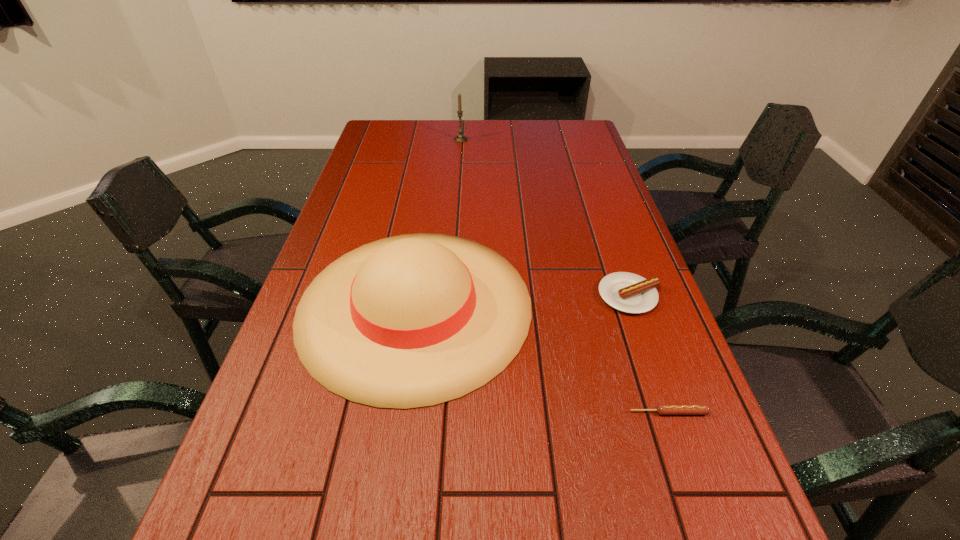
Where is `free space between the shortest object and the sombrero`? This screenshot has width=960, height=540. free space between the shortest object and the sombrero is located at coordinates (541, 359).

Locate an element on the screen. This screenshot has width=960, height=540. free space between the farther sausage and the candle is located at coordinates (545, 218).

Find the location of `empty location between the sombrero and the shortest object`. empty location between the sombrero and the shortest object is located at coordinates (541, 359).

The width and height of the screenshot is (960, 540). What are the coordinates of `empty space between the candle and the taller sausage` in the screenshot? It's located at (545, 218).

Where is `empty space that is in between the farthest object and the sombrero`? The image size is (960, 540). empty space that is in between the farthest object and the sombrero is located at coordinates (438, 222).

Identify which object is the third nearest to the shortest object. Please provide its 2D coordinates. Your answer should be formatted as a tuple, i.e. [(x, y)], where the tuple contains the x and y coordinates of a point satisfying the conditions above.

[(460, 138)]

Locate an element on the screen. The width and height of the screenshot is (960, 540). object that stands as the second closest to the candle is located at coordinates (627, 292).

Find the location of a particular element. The height and width of the screenshot is (540, 960). vacant space that satisfies the following two spatial constraints: 1. on the front side of the farthest object; 2. on the right side of the taller sausage is located at coordinates (450, 295).

At what (x,y) coordinates should I click in order to perform the action: click on vacant point that satisfies the following two spatial constraints: 1. on the back side of the sombrero; 2. on the right side of the farther sausage. Please return your answer as a coordinate pair (x, y). Image resolution: width=960 pixels, height=540 pixels. Looking at the image, I should click on (417, 295).

Image resolution: width=960 pixels, height=540 pixels. Find the location of `vacant area that satisfies the following two spatial constraints: 1. on the front side of the farther sausage; 2. on the right side of the candle`. vacant area that satisfies the following two spatial constraints: 1. on the front side of the farther sausage; 2. on the right side of the candle is located at coordinates (450, 295).